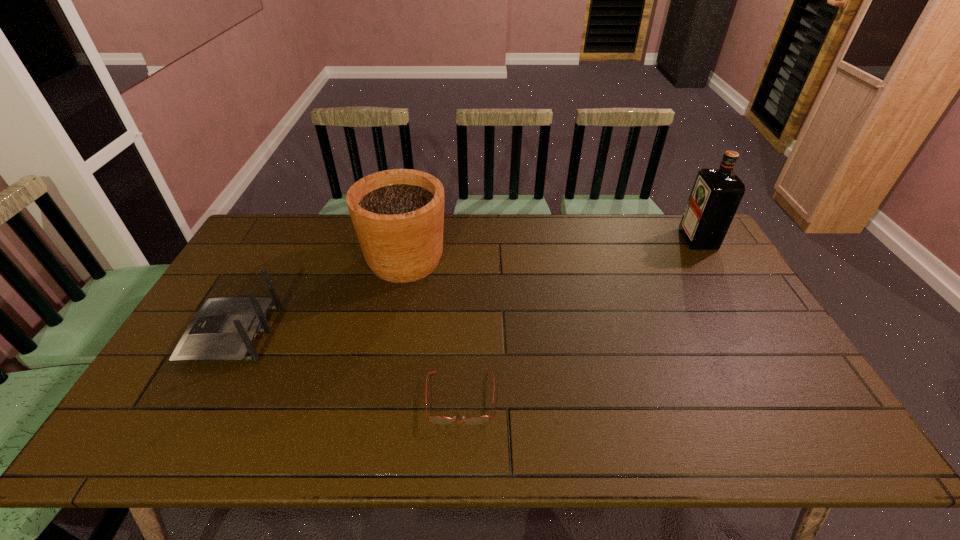
Locate an element on the screen. vacant area at the right edge of the desktop is located at coordinates (744, 334).

The image size is (960, 540). Find the location of `vacant space at the far right corner of the desktop`. vacant space at the far right corner of the desktop is located at coordinates (663, 237).

Find the location of a particular element. The width and height of the screenshot is (960, 540). vacant region between the second tallest object and the rightmost object is located at coordinates (552, 249).

At what (x,y) coordinates should I click in order to perform the action: click on free space between the liquor and the leftmost object. Please return your answer as a coordinate pair (x, y). Looking at the image, I should click on (466, 287).

This screenshot has height=540, width=960. I want to click on vacant area that lies between the third shortest object and the liquor, so click(552, 249).

You are a GUI agent. You are given a task and a screenshot of the screen. Output one action in this format:
    pyautogui.click(x=<x>, y=<y>)
    Task: Click on the unoccupied position between the flowerpot and the liquor
    
    Given the screenshot: What is the action you would take?
    pyautogui.click(x=552, y=249)

Locate an element on the screen. This screenshot has width=960, height=540. vacant point located between the second tallest object and the liquor is located at coordinates (552, 249).

At what (x,y) coordinates should I click in order to perform the action: click on free space between the rightmost object and the leftmost object. Please return your answer as a coordinate pair (x, y). This screenshot has width=960, height=540. Looking at the image, I should click on (466, 287).

Where is `vacant area that lies between the third shortest object and the liquor`? The image size is (960, 540). vacant area that lies between the third shortest object and the liquor is located at coordinates (552, 249).

I want to click on free space between the third tallest object and the tallest object, so click(466, 287).